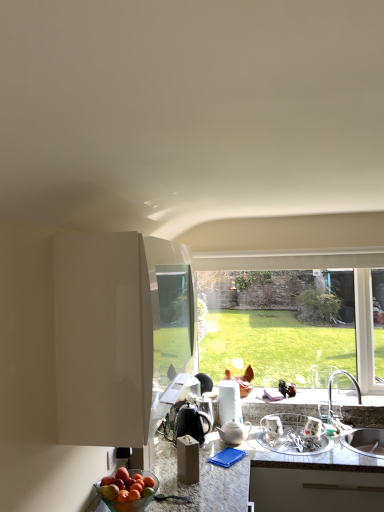
At what (x,y) coordinates should I click in order to perform the action: click on vacant point to the left of metallic silver dish rack at lower right, the 1th appliance viewed from the right. Please return your answer as a coordinate pair (x, y). The width and height of the screenshot is (384, 512). Looking at the image, I should click on (275, 440).